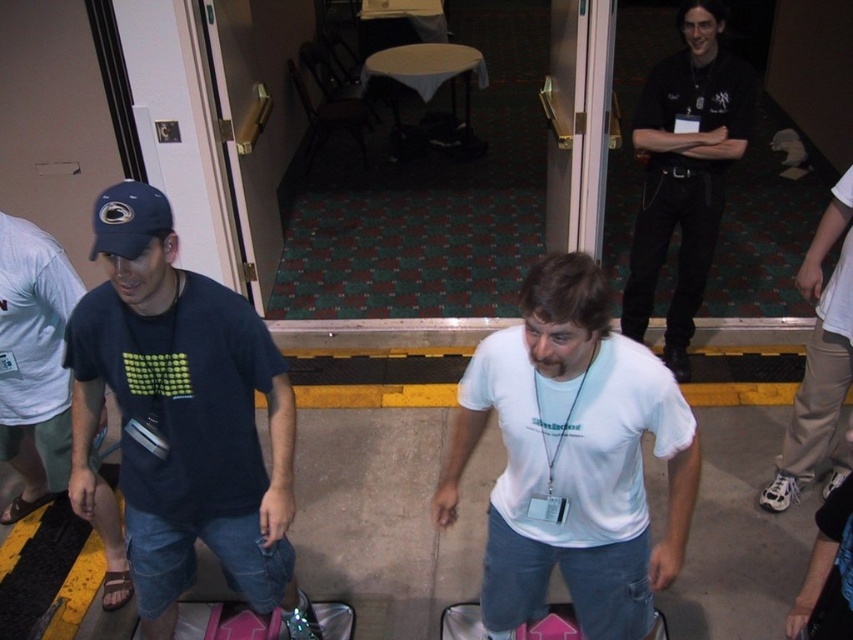
Question: Is dark blue cotton t-shirt at left wider than dark blue fabric cap at left?

Choices:
 (A) yes
 (B) no

Answer: (B)

Question: Which of these objects is positioned farthest from the dark blue cotton t-shirt at left?

Choices:
 (A) dark blue fabric cap at left
 (B) pink plastic suitcase at lower center
 (C) black matte shirt at upper center
 (D) white matte t-shirt at center

Answer: (C)

Question: Which object is positioned closest to the matte blue baseball cap at upper left?

Choices:
 (A) black matte shirt at upper center
 (B) dark blue fabric cap at left
 (C) pink plastic suitcase at lower center

Answer: (B)

Question: Is the position of white matte t-shirt at center more distant than that of pink plastic suitcase at lower center?

Choices:
 (A) no
 (B) yes

Answer: (A)

Question: Does dark blue cotton t-shirt at left appear on the right side of dark blue fabric cap at left?

Choices:
 (A) yes
 (B) no

Answer: (A)

Question: Estimate the real-world distances between objects in this image. Which object is closer to the dark blue cotton t-shirt at left?

Choices:
 (A) pink plastic suitcase at lower center
 (B) dark blue fabric cap at left
 (C) matte blue baseball cap at upper left

Answer: (C)